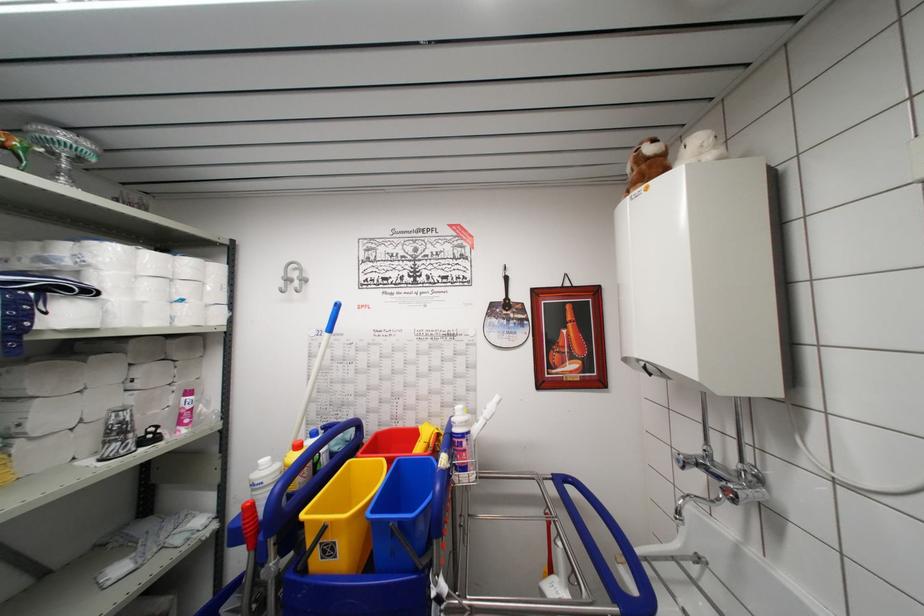
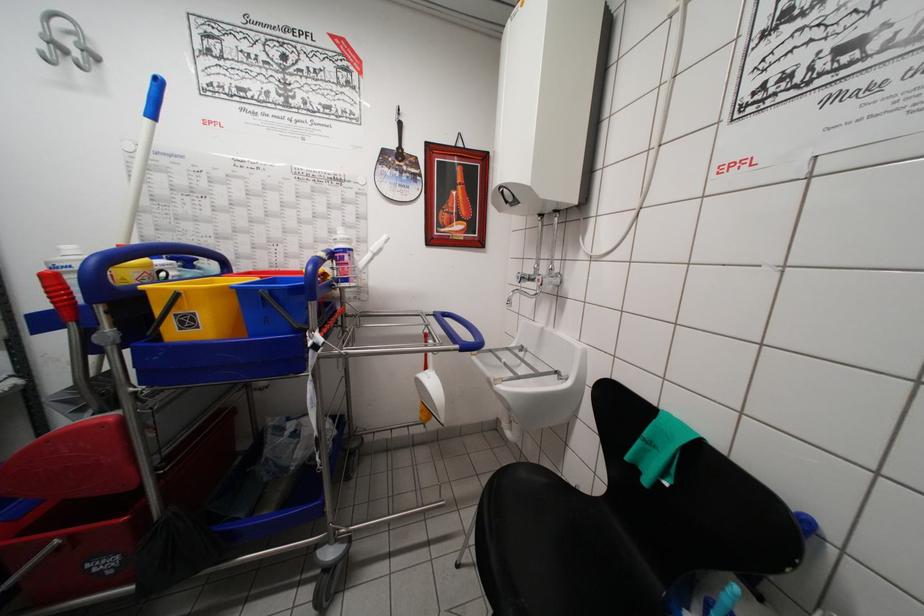
Where in the second image is the point corresponding to [653,379] from the first image?

(511, 207)